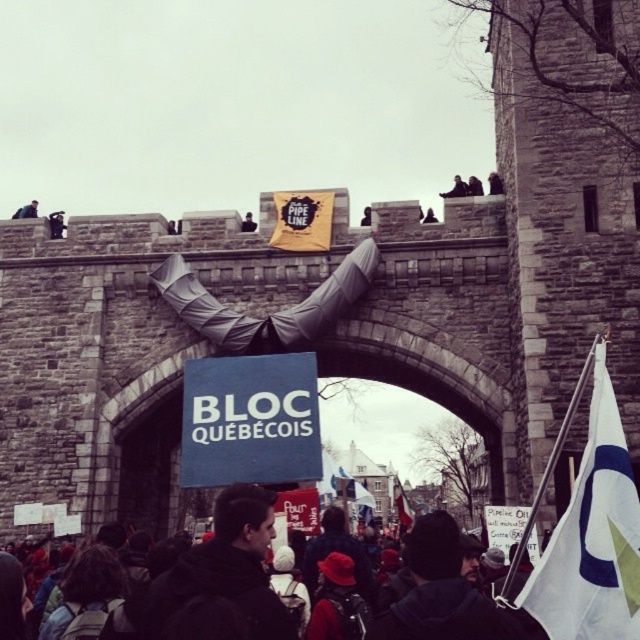
You are a drone operator trying to capture a clear photo of the protest scene. You have two points marked in your camera viewfinder. Point A is at coordinates point (x=301, y=209) and Point B is at point (x=29, y=208). Which point is closer to your drone camera lens?

Point A is closer to the viewer than point B because the point (x=301, y=209) is closer to the viewer than point (x=29, y=208) according to the description.